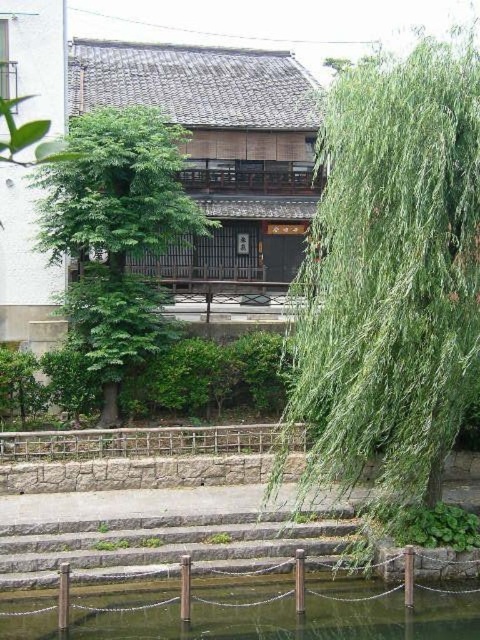
You are standing in front of the traditional Japanese building and notice two trees in the garden. Which tree, the green leafy willow at right or the green leafy tree at center, is closer to you?

The green leafy willow at right is closer to you because it is positioned in front of the green leafy tree at center.